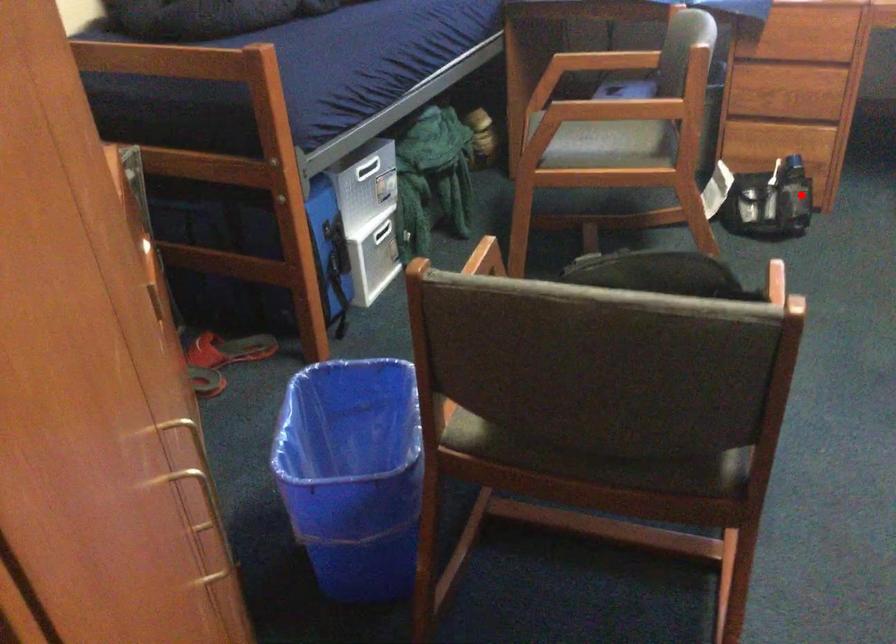
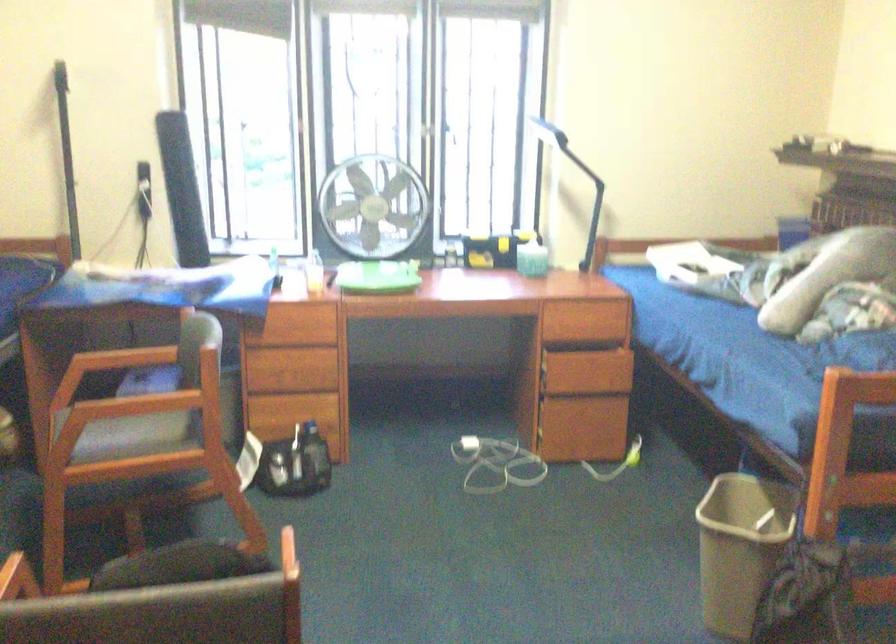
The point at the highlighted location is marked in the first image. Where is the corresponding point in the second image?

(314, 457)